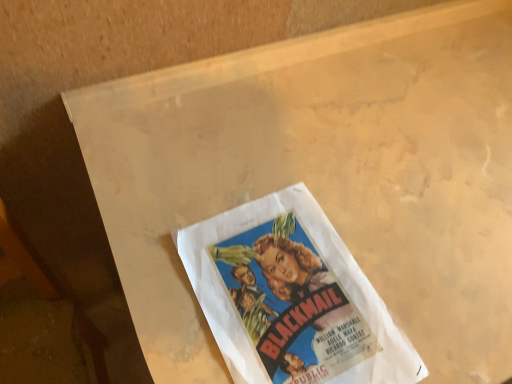
Locate an element on the screen. free point above matte paper poster at center (from a real-world perspective) is located at coordinates (292, 296).